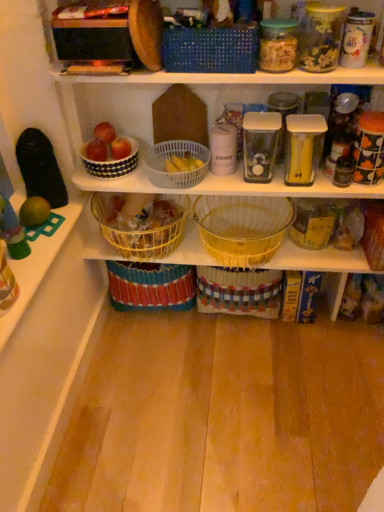
Question: Is white dotted bowl at upper left far from white glossy canister at upper right, which appears as the 5th glass jar when viewed from the left?

Choices:
 (A) yes
 (B) no

Answer: (B)

Question: From a real-world perspective, is white dotted bowl at upper left on top of white glossy canister at upper right, arranged as the 1th glass jar when viewed from the right?

Choices:
 (A) yes
 (B) no

Answer: (B)

Question: Does white dotted bowl at upper left appear on the right side of white glossy canister at upper right, which appears as the 5th glass jar when viewed from the left?

Choices:
 (A) no
 (B) yes

Answer: (A)

Question: Is white glossy canister at upper right, which appears as the 5th glass jar when viewed from the left, a part of white dotted bowl at upper left?

Choices:
 (A) yes
 (B) no

Answer: (B)

Question: Can you confirm if white dotted bowl at upper left is shorter than white glossy canister at upper right, arranged as the 1th glass jar when viewed from the right?

Choices:
 (A) no
 (B) yes

Answer: (B)

Question: Is white dotted bowl at upper left positioned behind white glossy canister at upper right, arranged as the 1th glass jar when viewed from the right?

Choices:
 (A) yes
 (B) no

Answer: (A)

Question: Can you confirm if transparent plastic container at center, the first glass jar when ordered from left to right, is shorter than white dotted bowl at upper left?

Choices:
 (A) no
 (B) yes

Answer: (A)

Question: From a real-world perspective, is transparent plastic container at center, the 5th glass jar from the right, under white dotted bowl at upper left?

Choices:
 (A) no
 (B) yes

Answer: (A)

Question: Are transparent plastic container at center, the 5th glass jar from the right, and white dotted bowl at upper left located far from each other?

Choices:
 (A) no
 (B) yes

Answer: (A)

Question: Is transparent plastic container at center, the first glass jar when ordered from left to right, oriented towards white dotted bowl at upper left?

Choices:
 (A) yes
 (B) no

Answer: (B)

Question: Is transparent plastic container at center, the 5th glass jar from the right, closer to camera compared to white dotted bowl at upper left?

Choices:
 (A) no
 (B) yes

Answer: (B)

Question: Is white dotted bowl at upper left at the back of transparent plastic container at center, the 5th glass jar from the right?

Choices:
 (A) no
 (B) yes

Answer: (A)

Question: From the image's perspective, is white glossy canister at upper right, arranged as the 1th glass jar when viewed from the right, located beneath black glass jar at right?

Choices:
 (A) no
 (B) yes

Answer: (A)